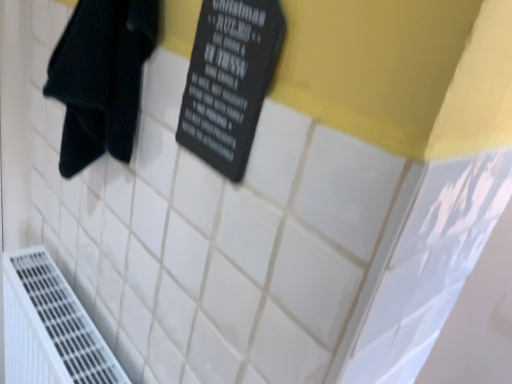
Question: Is white plastic air conditioning at lower left spatially inside black fabric towel at left, or outside of it?

Choices:
 (A) inside
 (B) outside

Answer: (B)

Question: Considering the positions of white plastic air conditioning at lower left and black fabric towel at left in the image, is white plastic air conditioning at lower left wider or thinner than black fabric towel at left?

Choices:
 (A) wide
 (B) thin

Answer: (B)

Question: Considering the real-world distances, which object is closest to the white plastic air conditioning at lower left?

Choices:
 (A) black matte sign at upper center
 (B) black fabric towel at left

Answer: (B)

Question: Based on their relative distances, which object is farther from the black matte sign at upper center?

Choices:
 (A) white plastic air conditioning at lower left
 (B) black fabric towel at left

Answer: (A)